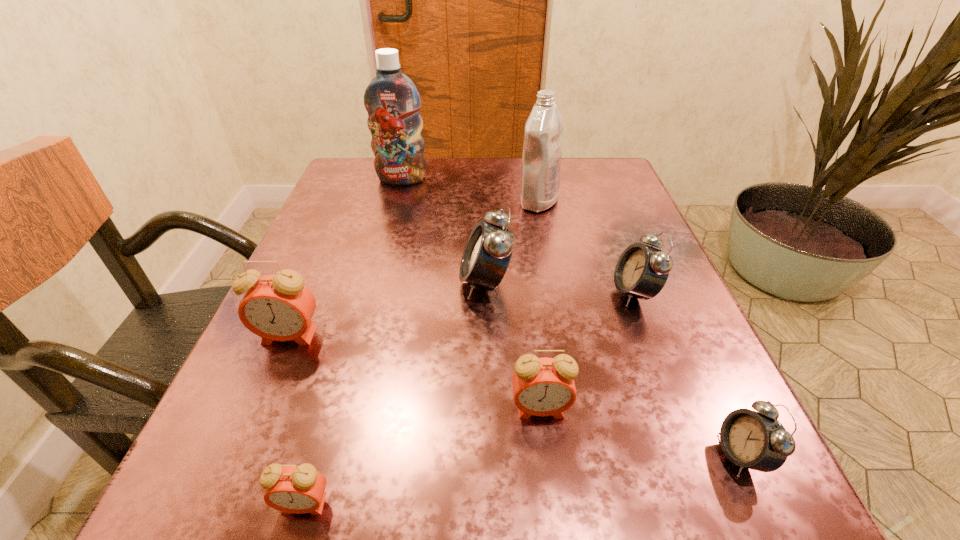
In order to click on the smallest white alarm clock in this screenshot , I will do `click(755, 440)`.

What are the coordinates of `the fifth farthest alarm clock` in the screenshot? It's located at (755, 440).

Locate an element on the screen. Image resolution: width=960 pixels, height=540 pixels. the nearest alarm clock is located at coordinates (300, 489).

At what (x,y) coordinates should I click in order to perform the action: click on the nearest pink alarm clock. Please return your answer as a coordinate pair (x, y). The image size is (960, 540). Looking at the image, I should click on click(300, 489).

This screenshot has width=960, height=540. I want to click on free space located 0.210m on the front label of the blue shampoo, so click(386, 238).

You are a GUI agent. You are given a task and a screenshot of the screen. Output one action in this format:
    pyautogui.click(x=<x>, y=<y>)
    Task: Click on the free space located on the left of the second farthest object
    This screenshot has height=540, width=960.
    Given the screenshot: What is the action you would take?
    pyautogui.click(x=391, y=201)

Where is `vacant space located 0.260m on the face of the leftmost white alarm clock`? This screenshot has height=540, width=960. vacant space located 0.260m on the face of the leftmost white alarm clock is located at coordinates (315, 282).

Find the location of `vacant space positioned on the face of the leftmost white alarm clock`. vacant space positioned on the face of the leftmost white alarm clock is located at coordinates tap(287, 282).

The image size is (960, 540). In order to click on free space located on the face of the leftmost white alarm clock in this screenshot , I will do `click(320, 282)`.

This screenshot has width=960, height=540. Find the location of `vacant space located on the face of the fifth farthest object`. vacant space located on the face of the fifth farthest object is located at coordinates (232, 468).